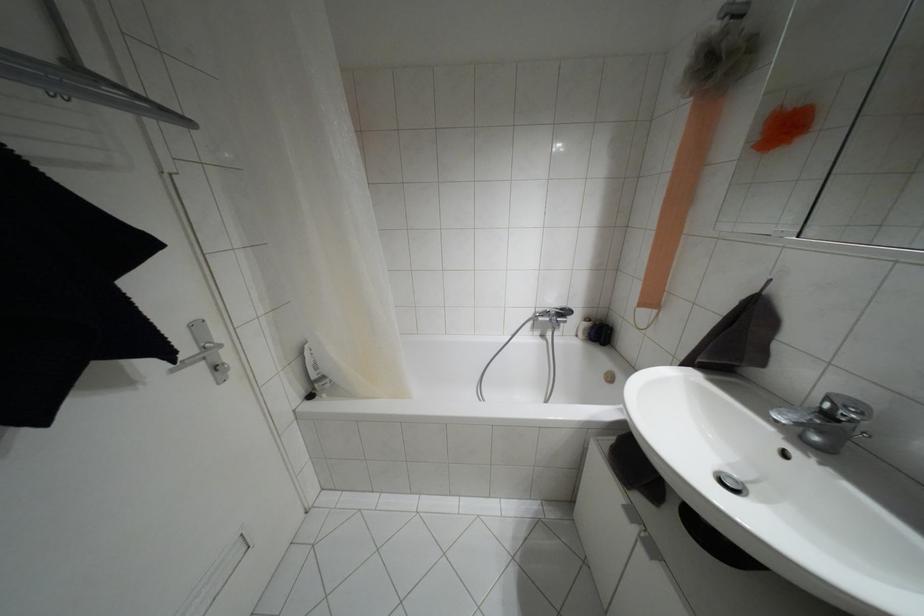
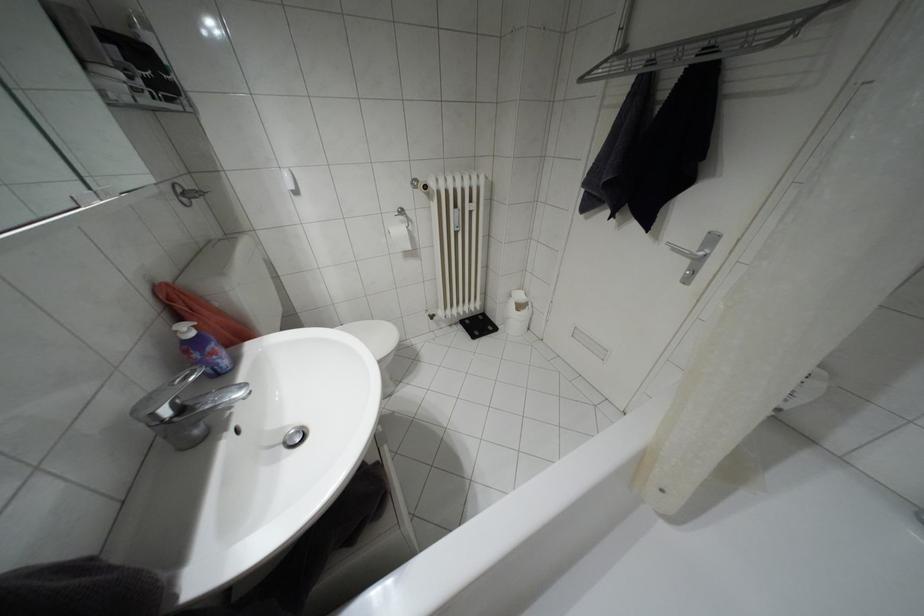
Where in the second image is the point corresponding to point (825, 414) from the first image?

(180, 408)